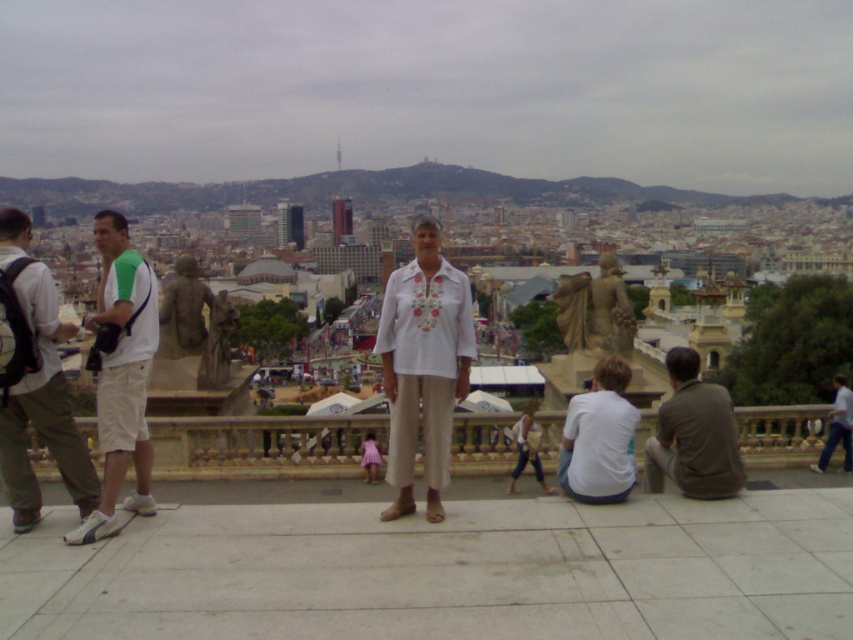
Locate an element on the screen. The image size is (853, 640). white embroidered blouse at center is located at coordinates (422, 364).

Is white embroidered blouse at center behind white cotton shirt at center?

No, white embroidered blouse at center is in front of white cotton shirt at center.

Which is in front, point (456, 365) or point (511, 492)?

Point (456, 365) is more forward.

Find the location of a particular element. This screenshot has width=853, height=640. white embroidered blouse at center is located at coordinates (422, 364).

Does white cotton shirt at lower right appear on the right side of white cotton shirt at center?

Indeed, white cotton shirt at lower right is positioned on the right side of white cotton shirt at center.

Does point (606, 408) come closer to viewer compared to point (535, 449)?

Yes, it is in front of point (535, 449).

Which is in front, point (575, 420) or point (526, 428)?

Point (575, 420) is in front.

Where is `white cotton shirt at lower right`? The height and width of the screenshot is (640, 853). white cotton shirt at lower right is located at coordinates tap(599, 438).

Is green fabric shirt at left to the right of white cotton shirt at lower right from the viewer's perspective?

No, green fabric shirt at left is not to the right of white cotton shirt at lower right.

Which is above, green fabric shirt at left or white cotton shirt at lower right?

green fabric shirt at left is above.

Between point (61, 397) and point (567, 483), which one is positioned behind?

The point (567, 483) is behind.

Image resolution: width=853 pixels, height=640 pixels. In order to click on green fabric shirt at left in this screenshot , I will do `click(42, 410)`.